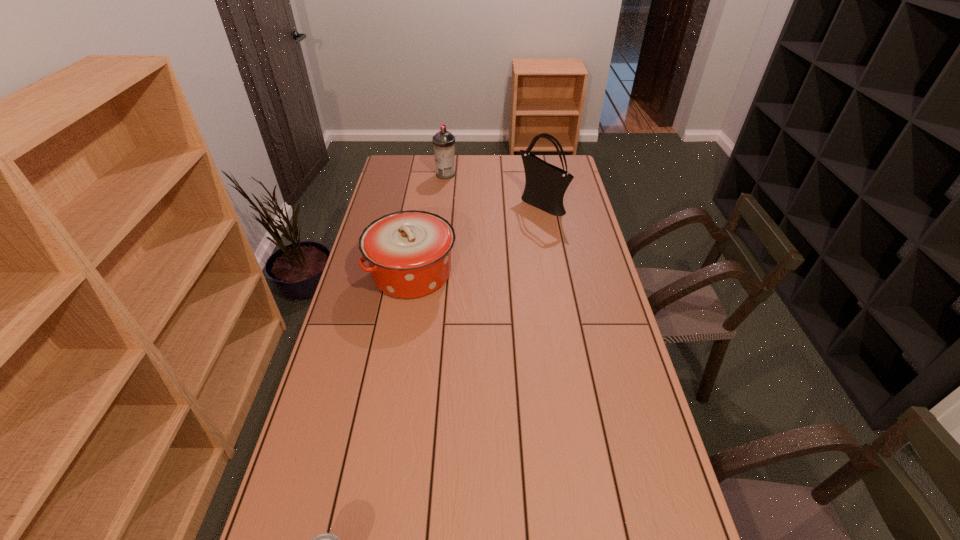
Where is `the rightmost object`? Image resolution: width=960 pixels, height=540 pixels. the rightmost object is located at coordinates (545, 184).

Locate an element on the screen. The height and width of the screenshot is (540, 960). the tallest object is located at coordinates (545, 184).

I want to click on the second tallest object, so click(x=443, y=141).

Locate an element on the screen. The width and height of the screenshot is (960, 540). aerosol can is located at coordinates (443, 141).

The width and height of the screenshot is (960, 540). Identify the location of the third tallest object. (409, 252).

You are a GUI agent. You are given a task and a screenshot of the screen. Output one action in this format:
    pyautogui.click(x=<x>, y=<y>)
    Task: Click on the second nearest object
    The width and height of the screenshot is (960, 540).
    Given the screenshot: What is the action you would take?
    pyautogui.click(x=409, y=252)

Locate an element on the screen. free space located 0.190m on the front of the third nearest object is located at coordinates (549, 248).

You are a GUI agent. You are given a task and a screenshot of the screen. Output one action in this format:
    pyautogui.click(x=<x>, y=<y>)
    Task: Click on the vacant space located on the front of the third shortest object
    
    Given the screenshot: What is the action you would take?
    pyautogui.click(x=444, y=198)

At what (x,y) coordinates should I click in order to perform the action: click on free space located 0.170m on the front of the casserole. Please return your answer as a coordinate pair (x, y). The image size is (960, 540). Looking at the image, I should click on (400, 346).

At what (x,y) coordinates should I click in order to perform the action: click on object at the far edge. Please return your answer as a coordinate pair (x, y). Looking at the image, I should click on (443, 141).